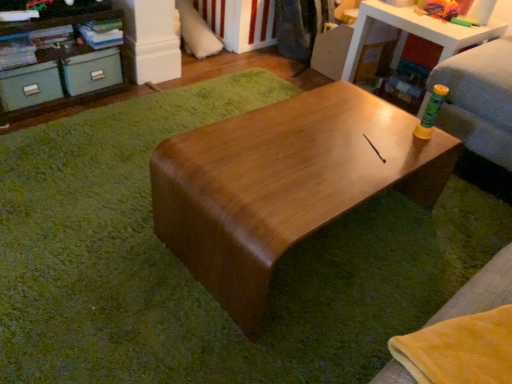
Identify the location of free point to the left of shiny brown table at center, placed as the 2th table when sorted from back to front. The height and width of the screenshot is (384, 512). (96, 205).